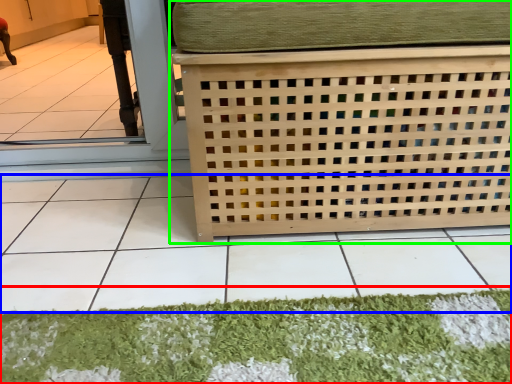
Question: Considering the real-world distances, which object is farthest from mat (highlighted by a red box)? tile (highlighted by a blue box) or furniture (highlighted by a green box)?

Choices:
 (A) tile
 (B) furniture

Answer: (B)